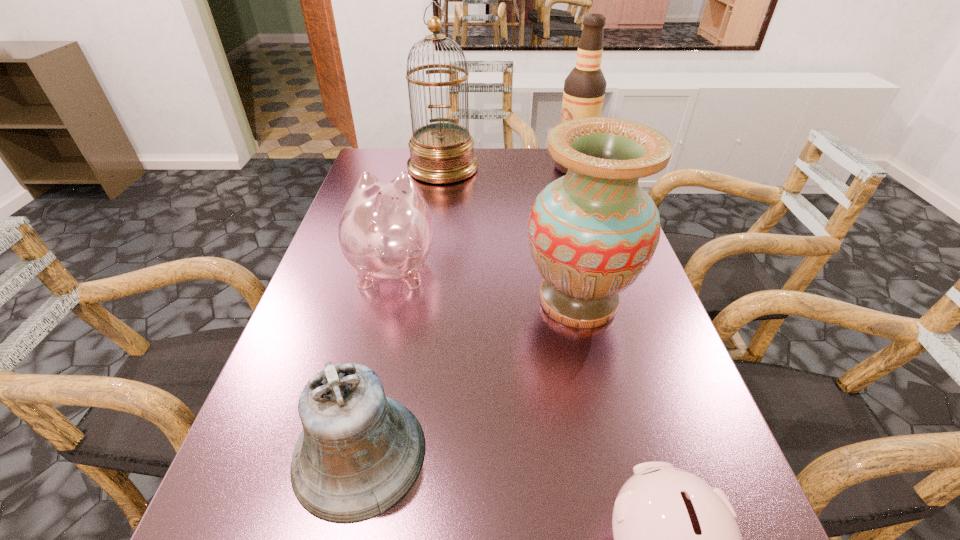
This screenshot has width=960, height=540. Find the location of `free space between the left piggy bank and the alcohol`. free space between the left piggy bank and the alcohol is located at coordinates (483, 216).

Locate an element on the screen. The height and width of the screenshot is (540, 960). vacant area that lies between the bell and the alcohol is located at coordinates (467, 310).

Locate an element on the screen. The width and height of the screenshot is (960, 540). free spot between the alcohol and the birdcage is located at coordinates (508, 167).

Find the location of a particular element. The image size is (960, 540). vacant space that's between the birdcage and the bell is located at coordinates (401, 310).

Locate an element on the screen. This screenshot has height=540, width=960. object that is the closest to the taller piggy bank is located at coordinates (592, 233).

Locate which object is the fifth closest to the bell. Please provide its 2D coordinates. Your answer should be formatted as a tuple, i.e. [(x, y)], where the tuple contains the x and y coordinates of a point satisfying the conditions above.

[(584, 88)]

I want to click on free point that satisfies the following two spatial constraints: 1. on the label of the alcohol; 2. with an open door on the birdcage, so click(x=573, y=168).